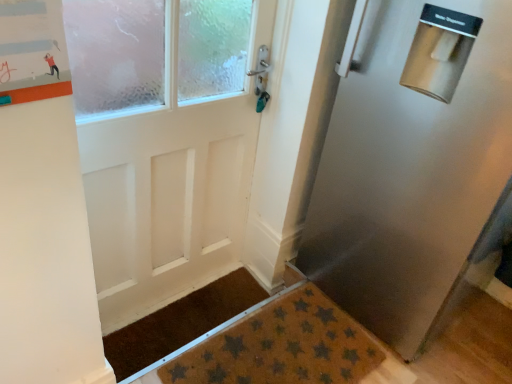
What do you see at coordinates (32, 51) in the screenshot?
I see `orange matte bulletin board at upper left` at bounding box center [32, 51].

The width and height of the screenshot is (512, 384). Describe the element at coordinates (409, 174) in the screenshot. I see `stainless steel refrigerator at right` at that location.

This screenshot has width=512, height=384. I want to click on orange matte bulletin board at upper left, so tap(32, 51).

Is orange matte bulletin board at upper left positioned before stainless steel refrigerator at right?

Yes.

Would you say orange matte bulletin board at upper left is a long distance from stainless steel refrigerator at right?

orange matte bulletin board at upper left is positioned a significant distance from stainless steel refrigerator at right.

From the image's perspective, who appears lower, orange matte bulletin board at upper left or stainless steel refrigerator at right?

stainless steel refrigerator at right appears lower in the image.

At what (x,y) coordinates should I click in order to perform the action: click on door in front of the brown textured doormat at lower center, which appears as the first doormat when viewed from the front. Please return your answer as a coordinate pair (x, y). Looking at the image, I should click on (409, 174).

Who is more distant, stainless steel refrigerator at right or brown textured doormat at lower center, which appears as the second doormat when viewed from the back?

brown textured doormat at lower center, which appears as the second doormat when viewed from the back, is more distant.

Is stainless steel refrigerator at right touching brown textured doormat at lower center, which appears as the first doormat when viewed from the front?

No, stainless steel refrigerator at right is not in contact with brown textured doormat at lower center, which appears as the first doormat when viewed from the front.

Which is more to the left, stainless steel refrigerator at right or brown textured doormat at lower center, which appears as the second doormat when viewed from the back?

Positioned to the left is brown textured doormat at lower center, which appears as the second doormat when viewed from the back.

Which of these two, brown textured mat at lower center, which appears as the 1th doormat when viewed from the back, or orange matte bulletin board at upper left, is thinner?

Thinner between the two is orange matte bulletin board at upper left.

Considering the sizes of objects brown textured mat at lower center, acting as the 2th doormat starting from the front, and orange matte bulletin board at upper left in the image provided, who is taller, brown textured mat at lower center, acting as the 2th doormat starting from the front, or orange matte bulletin board at upper left?

orange matte bulletin board at upper left is taller.

Is brown textured mat at lower center, which appears as the 1th doormat when viewed from the back, closer to camera compared to orange matte bulletin board at upper left?

No, it is not.

I want to click on the 2nd doormat behind the orange matte bulletin board at upper left, so [x=180, y=322].

Based on the photo, from the image's perspective, would you say stainless steel refrigerator at right is positioned over brown textured mat at lower center, acting as the 2th doormat starting from the front?

Indeed, from the image's perspective, stainless steel refrigerator at right is shown above brown textured mat at lower center, acting as the 2th doormat starting from the front.

There is a stainless steel refrigerator at right. At what (x,y) coordinates should I click in order to perform the action: click on the 1st doormat below it (from the image's perspective). Please return your answer as a coordinate pair (x, y). Looking at the image, I should click on (180, 322).

Can you confirm if stainless steel refrigerator at right is shorter than brown textured mat at lower center, which appears as the 1th doormat when viewed from the back?

Incorrect, the height of stainless steel refrigerator at right does not fall short of that of brown textured mat at lower center, which appears as the 1th doormat when viewed from the back.

Which object is more forward, stainless steel refrigerator at right or brown textured mat at lower center, which appears as the 1th doormat when viewed from the back?

Positioned in front is stainless steel refrigerator at right.

Are brown textured doormat at lower center, which appears as the second doormat when viewed from the back, and stainless steel refrigerator at right beside each other?

No, brown textured doormat at lower center, which appears as the second doormat when viewed from the back, is not beside stainless steel refrigerator at right.

Between brown textured doormat at lower center, which appears as the second doormat when viewed from the back, and stainless steel refrigerator at right, which one appears on the left side from the viewer's perspective?

brown textured doormat at lower center, which appears as the second doormat when viewed from the back, is more to the left.

Does brown textured doormat at lower center, which appears as the first doormat when viewed from the front, have a smaller size compared to stainless steel refrigerator at right?

Indeed, brown textured doormat at lower center, which appears as the first doormat when viewed from the front, has a smaller size compared to stainless steel refrigerator at right.

Is brown textured mat at lower center, acting as the 2th doormat starting from the front, situated inside brown textured doormat at lower center, which appears as the second doormat when viewed from the back, or outside?

brown textured mat at lower center, acting as the 2th doormat starting from the front, is not enclosed by brown textured doormat at lower center, which appears as the second doormat when viewed from the back.

Considering the sizes of brown textured mat at lower center, which appears as the 1th doormat when viewed from the back, and brown textured doormat at lower center, which appears as the second doormat when viewed from the back, in the image, is brown textured mat at lower center, which appears as the 1th doormat when viewed from the back, wider or thinner than brown textured doormat at lower center, which appears as the second doormat when viewed from the back,?

brown textured mat at lower center, which appears as the 1th doormat when viewed from the back, is thinner than brown textured doormat at lower center, which appears as the second doormat when viewed from the back.

Are brown textured mat at lower center, which appears as the 1th doormat when viewed from the back, and brown textured doormat at lower center, which appears as the second doormat when viewed from the back, making contact?

brown textured mat at lower center, which appears as the 1th doormat when viewed from the back, and brown textured doormat at lower center, which appears as the second doormat when viewed from the back, are not in contact.

Which of these two, brown textured mat at lower center, which appears as the 1th doormat when viewed from the back, or brown textured doormat at lower center, which appears as the second doormat when viewed from the back, is smaller?

brown textured mat at lower center, which appears as the 1th doormat when viewed from the back, is smaller.

Is point (329, 336) closer to viewer compared to point (41, 25)?

No, (329, 336) is behind (41, 25).

From the image's perspective, which is below, brown textured doormat at lower center, which appears as the second doormat when viewed from the back, or orange matte bulletin board at upper left?

From the image's view, brown textured doormat at lower center, which appears as the second doormat when viewed from the back, is below.

Image resolution: width=512 pixels, height=384 pixels. Identify the location of bulletin board in front of the brown textured doormat at lower center, which appears as the first doormat when viewed from the front. (32, 51).

You are a GUI agent. You are given a task and a screenshot of the screen. Output one action in this format:
    pyautogui.click(x=<x>, y=<y>)
    Task: Click on the bulletin board above the stainless steel refrigerator at right (from a real-world perspective)
    The image size is (512, 384).
    Given the screenshot: What is the action you would take?
    pyautogui.click(x=32, y=51)

Find the location of a particular element. door to the right of brown textured doormat at lower center, which appears as the first doormat when viewed from the front is located at coordinates (409, 174).

Which object lies further to the anchor point brown textured mat at lower center, acting as the 2th doormat starting from the front, brown textured doormat at lower center, which appears as the second doormat when viewed from the back, or stainless steel refrigerator at right?

Based on the image, stainless steel refrigerator at right appears to be further to brown textured mat at lower center, acting as the 2th doormat starting from the front.

Looking at the image, which one is located further to orange matte bulletin board at upper left, brown textured mat at lower center, acting as the 2th doormat starting from the front, or brown textured doormat at lower center, which appears as the second doormat when viewed from the back?

brown textured mat at lower center, acting as the 2th doormat starting from the front, lies further to orange matte bulletin board at upper left than the other object.

Considering their positions, is orange matte bulletin board at upper left positioned further to brown textured doormat at lower center, which appears as the first doormat when viewed from the front, than brown textured mat at lower center, acting as the 2th doormat starting from the front?

orange matte bulletin board at upper left is further to brown textured doormat at lower center, which appears as the first doormat when viewed from the front.

Which object lies further to the anchor point stainless steel refrigerator at right, brown textured mat at lower center, acting as the 2th doormat starting from the front, or brown textured doormat at lower center, which appears as the first doormat when viewed from the front?

brown textured mat at lower center, acting as the 2th doormat starting from the front.

Considering their positions, is orange matte bulletin board at upper left positioned closer to stainless steel refrigerator at right than brown textured mat at lower center, which appears as the 1th doormat when viewed from the back?

The object closer to stainless steel refrigerator at right is brown textured mat at lower center, which appears as the 1th doormat when viewed from the back.

Based on their spatial positions, is brown textured mat at lower center, acting as the 2th doormat starting from the front, or orange matte bulletin board at upper left further from stainless steel refrigerator at right?

The object further to stainless steel refrigerator at right is orange matte bulletin board at upper left.

Based on the photo, based on their spatial positions, is brown textured doormat at lower center, which appears as the first doormat when viewed from the front, or brown textured mat at lower center, which appears as the 1th doormat when viewed from the back, further from stainless steel refrigerator at right?

brown textured mat at lower center, which appears as the 1th doormat when viewed from the back.

Looking at this image, based on their spatial positions, is stainless steel refrigerator at right or brown textured doormat at lower center, which appears as the second doormat when viewed from the back, closer to brown textured mat at lower center, which appears as the 1th doormat when viewed from the back?

The object closer to brown textured mat at lower center, which appears as the 1th doormat when viewed from the back, is brown textured doormat at lower center, which appears as the second doormat when viewed from the back.

Locate an element on the screen. The width and height of the screenshot is (512, 384). doormat between brown textured mat at lower center, which appears as the 1th doormat when viewed from the back, and stainless steel refrigerator at right, in the horizontal direction is located at coordinates (281, 347).

Find the location of `doormat located between orange matte bulletin board at upper left and brown textured mat at lower center, acting as the 2th doormat starting from the front, in the depth direction`. doormat located between orange matte bulletin board at upper left and brown textured mat at lower center, acting as the 2th doormat starting from the front, in the depth direction is located at coordinates (281, 347).